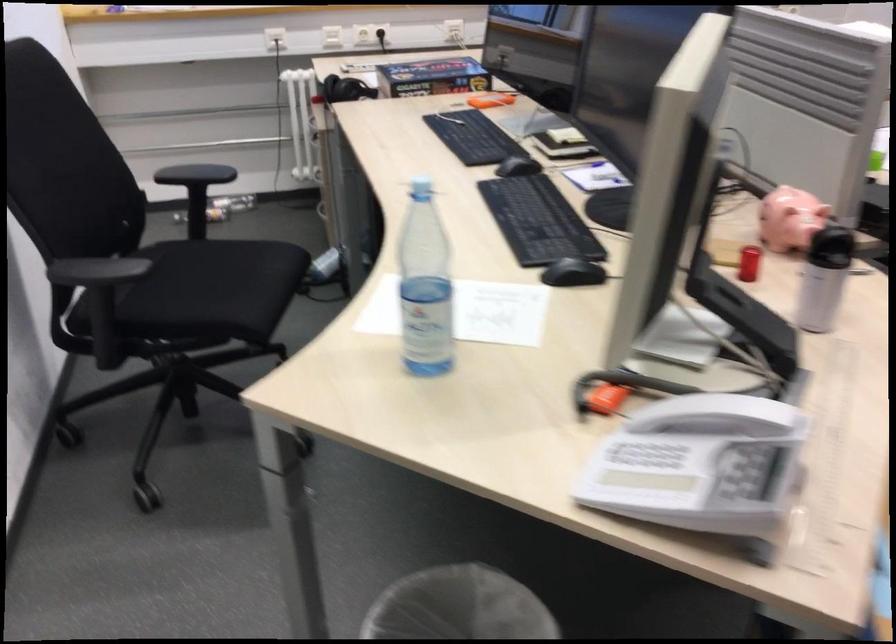
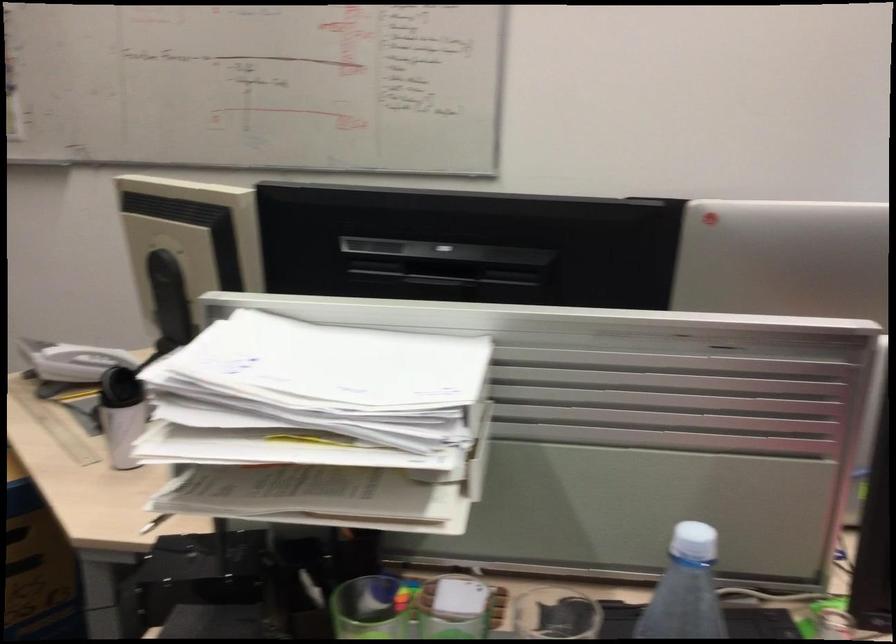
Where in the second image is the point corresponding to point (734, 433) from the first image?

(82, 362)